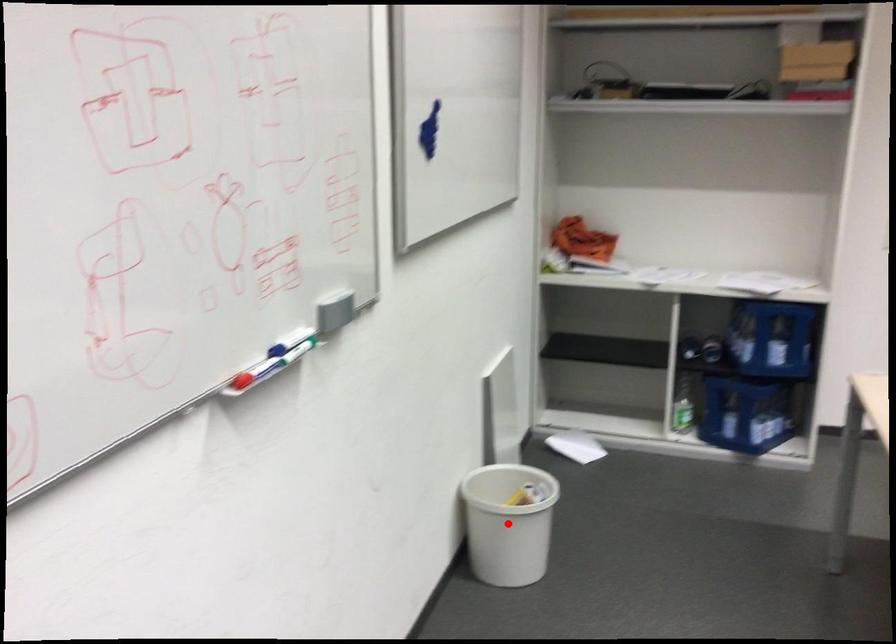
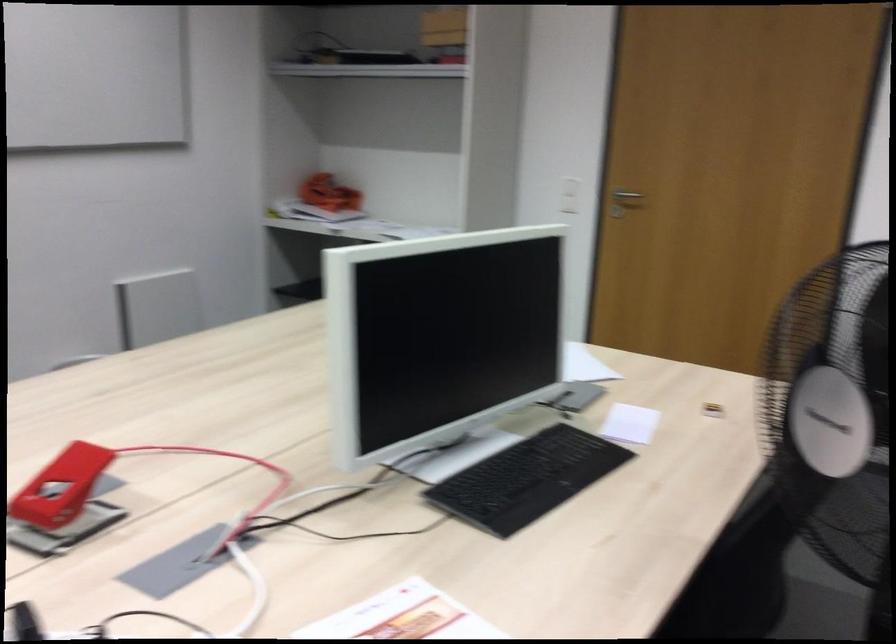
Question: I am providing you with two images of the same scene from different viewpoints. A red point is marked on the first image. At the location where the point appears in image 1, is it still visible in image 2?

Choices:
 (A) Yes
 (B) No

Answer: (B)